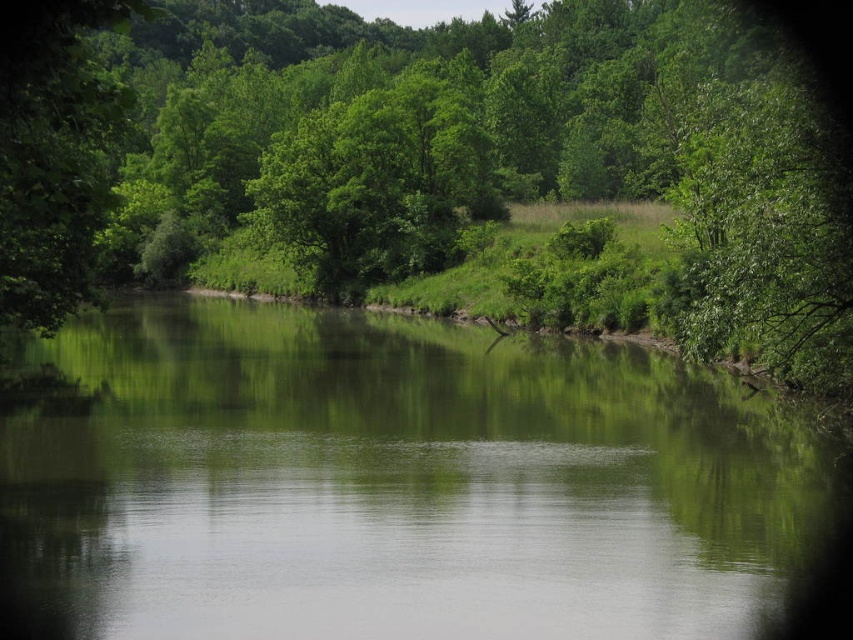
Question: Is green leafy tree at center below green leafy tree at left?

Choices:
 (A) yes
 (B) no

Answer: (B)

Question: Which of the following is the farthest from the observer?

Choices:
 (A) green leafy tree at center
 (B) green reflective water at center
 (C) green leafy tree at left

Answer: (B)

Question: Estimate the real-world distances between objects in this image. Which object is farther from the green leafy tree at left?

Choices:
 (A) green reflective water at center
 (B) green leafy tree at center

Answer: (B)

Question: Which is nearer to the green leafy tree at left?

Choices:
 (A) green reflective water at center
 (B) green leafy tree at center

Answer: (A)

Question: Is green reflective water at center to the right of green leafy tree at left from the viewer's perspective?

Choices:
 (A) no
 (B) yes

Answer: (B)

Question: Considering the relative positions of green leafy tree at center and green leafy tree at left in the image provided, where is green leafy tree at center located with respect to green leafy tree at left?

Choices:
 (A) left
 (B) right

Answer: (B)